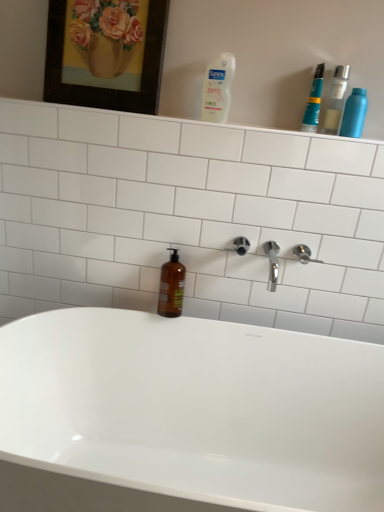
Question: Is white plastic bottle at upper center, which is the 1th cleaning product from left to right, not inside metallic blue spray can at upper right, which is counted as the 1th cleaning product, starting from the right?

Choices:
 (A) yes
 (B) no

Answer: (A)

Question: From the image's perspective, would you say white plastic bottle at upper center, which is the second cleaning product in right-to-left order, is positioned over metallic blue spray can at upper right, which is counted as the 1th cleaning product, starting from the right?

Choices:
 (A) yes
 (B) no

Answer: (A)

Question: From a real-world perspective, is white plastic bottle at upper center, which is the 1th cleaning product from left to right, positioned under metallic blue spray can at upper right, which is counted as the 1th cleaning product, starting from the right, based on gravity?

Choices:
 (A) yes
 (B) no

Answer: (B)

Question: Is white plastic bottle at upper center, which is the 1th cleaning product from left to right, positioned with its back to metallic blue spray can at upper right, acting as the 2th cleaning product starting from the left?

Choices:
 (A) no
 (B) yes

Answer: (A)

Question: Is white plastic bottle at upper center, which is the 1th cleaning product from left to right, thinner than metallic blue spray can at upper right, acting as the 2th cleaning product starting from the left?

Choices:
 (A) no
 (B) yes

Answer: (B)

Question: From the image's perspective, is brown glass bottle at center, placed as the first mouthwash when sorted from left to right, above or below metallic blue spray can at upper right, acting as the 2th cleaning product starting from the left?

Choices:
 (A) above
 (B) below

Answer: (B)

Question: Based on their sizes in the image, would you say brown glass bottle at center, the first mouthwash in the bottom-to-top sequence, is bigger or smaller than metallic blue spray can at upper right, acting as the 2th cleaning product starting from the left?

Choices:
 (A) big
 (B) small

Answer: (A)

Question: In the image, is brown glass bottle at center, which appears as the third mouthwash when viewed from the top, positioned in front of or behind metallic blue spray can at upper right, acting as the 2th cleaning product starting from the left?

Choices:
 (A) behind
 (B) front

Answer: (A)

Question: Is brown glass bottle at center, which appears as the third mouthwash when viewed from the top, to the left or to the right of metallic blue spray can at upper right, which is counted as the 1th cleaning product, starting from the right, in the image?

Choices:
 (A) left
 (B) right

Answer: (A)

Question: From the image's perspective, is wooden frame at upper left above or below transparent plastic bottle at upper right, positioned as the second mouthwash in bottom-to-top order?

Choices:
 (A) below
 (B) above

Answer: (B)

Question: Considering the positions of wooden frame at upper left and transparent plastic bottle at upper right, the first mouthwash from the right, in the image, is wooden frame at upper left wider or thinner than transparent plastic bottle at upper right, the first mouthwash from the right,?

Choices:
 (A) wide
 (B) thin

Answer: (B)

Question: Is wooden frame at upper left in front of or behind transparent plastic bottle at upper right, positioned as the second mouthwash in bottom-to-top order, in the image?

Choices:
 (A) front
 (B) behind

Answer: (A)

Question: From a real-world perspective, is wooden frame at upper left physically located above or below transparent plastic bottle at upper right, the third mouthwash positioned from the left?

Choices:
 (A) below
 (B) above

Answer: (B)

Question: In the image, is satin nickel shower at upper right positioned in front of or behind white glossy shelf at upper center?

Choices:
 (A) behind
 (B) front

Answer: (A)

Question: From a real-world perspective, is satin nickel shower at upper right above or below white glossy shelf at upper center?

Choices:
 (A) above
 (B) below

Answer: (B)